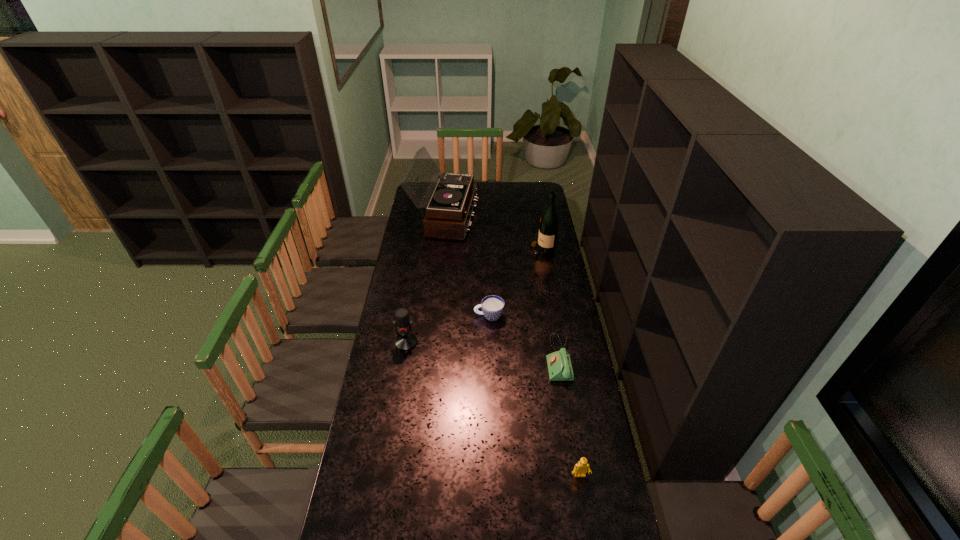
You are a GUI agent. You are given a task and a screenshot of the screen. Output one action in this format:
    pyautogui.click(x=<x>, y=<y>)
    Task: Click on the free space between the fourth nearest object and the microphone
    This screenshot has width=960, height=540.
    Given the screenshot: What is the action you would take?
    pyautogui.click(x=447, y=329)

You are a GUI agent. You are given a task and a screenshot of the screen. Output one action in this format:
    pyautogui.click(x=<x>, y=<y>)
    Task: Click on the vacant space in between the third shortest object and the fourth nearest object
    Image resolution: width=960 pixels, height=540 pixels.
    Given the screenshot: What is the action you would take?
    point(535,396)

This screenshot has height=540, width=960. Find the location of `free area in between the fourth shortest object and the record player`. free area in between the fourth shortest object and the record player is located at coordinates (425, 280).

Identify the location of free space that is in between the wine bottle and the microphone. The height and width of the screenshot is (540, 960). (474, 296).

Find the location of `vacant space that's between the nearest object and the microphone`. vacant space that's between the nearest object and the microphone is located at coordinates (493, 409).

You are a GUI agent. You are given a task and a screenshot of the screen. Output one action in this format:
    pyautogui.click(x=<x>, y=<y>)
    Task: Click on the empty location between the second farthest object and the cup
    This screenshot has height=540, width=960.
    Given the screenshot: What is the action you would take?
    pyautogui.click(x=516, y=284)

This screenshot has width=960, height=540. What are the coordinates of `empty space between the wine bottle and the fourth shortest object` in the screenshot? It's located at (474, 296).

At what (x,y) coordinates should I click in order to perform the action: click on vacant point located between the cup and the fourth shortest object. Please return your answer as a coordinate pair (x, y). The image size is (960, 540). Looking at the image, I should click on (447, 329).

Locate an element on the screen. free space that is in between the second farthest object and the microphone is located at coordinates (474, 296).

You are a GUI agent. You are given a task and a screenshot of the screen. Output one action in this format:
    pyautogui.click(x=<x>, y=<y>)
    Task: Click on the vacant space that's between the third farthest object and the wine bottle
    The image size is (960, 540).
    Given the screenshot: What is the action you would take?
    pyautogui.click(x=516, y=284)